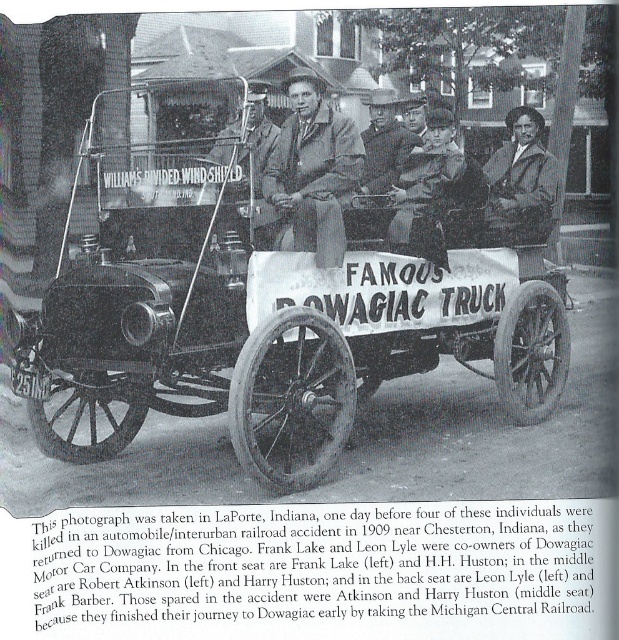
Consider the image. You are a photographer standing in front of the Famous Dowagiac Truck. You notice a metallic polished wagon at center and a matte brown coat at center. Which object is closer to you?

The metallic polished wagon at center is closer to you because it is in front of the matte brown coat at center.

You are a photographer standing in front of the Famous Dowagiac Truck. You notice two items on the truck bed. Which item is nearer to you, the dark brown fur coat at center or the smooth leather jacket at center?

The dark brown fur coat at center is closer to the viewer than the smooth leather jacket at center, so the dark brown fur coat at center is nearer to you.

You are a tailor trying to determine which item to repair first. You have a dark brown fur coat at center and a smooth leather jacket at center in your shop. Based on their positions, which item is taking up more space on your worktable?

The dark brown fur coat at center might be wider than smooth leather jacket at center, so it could be taking up more space on the worktable.